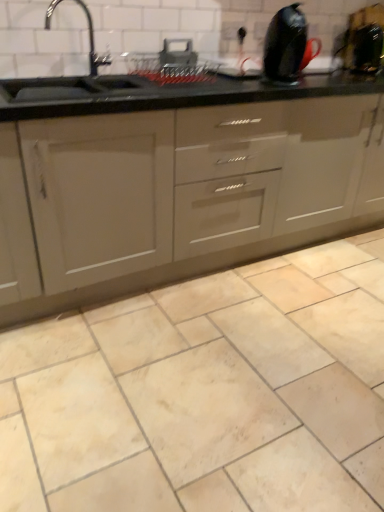
Image resolution: width=384 pixels, height=512 pixels. What do you see at coordinates (170, 64) in the screenshot? I see `metallic silver rack at upper center, the 1th appliance in the left-to-right sequence` at bounding box center [170, 64].

In order to face beige marble tile at center, should I rotate leftwards or rightwards?

You should look right and rotate roughly 15.475 degrees.

Locate an element on the screen. This screenshot has height=512, width=384. glossy black kettle at upper right, arranged as the 3th appliance when viewed from the left is located at coordinates (287, 46).

Image resolution: width=384 pixels, height=512 pixels. Find the location of `black glossy kettle at upper right, which is the 1th appliance from right to left`. black glossy kettle at upper right, which is the 1th appliance from right to left is located at coordinates (364, 49).

The width and height of the screenshot is (384, 512). I want to click on matte gray cabinet at center, so click(187, 192).

Choose the correct answer: Is glossy black kettle at upper right, arranged as the 3th appliance when viewed from the left, inside metallic silver rack at upper center, the 1th appliance in the left-to-right sequence, or outside it?

glossy black kettle at upper right, arranged as the 3th appliance when viewed from the left, is not enclosed by metallic silver rack at upper center, the 1th appliance in the left-to-right sequence.

From the image's perspective, is glossy black kettle at upper right, positioned as the 2th appliance in right-to-left order, above or below metallic silver rack at upper center, acting as the 4th appliance starting from the right?

glossy black kettle at upper right, positioned as the 2th appliance in right-to-left order, is situated higher than metallic silver rack at upper center, acting as the 4th appliance starting from the right, in the image.

Who is taller, glossy black kettle at upper right, positioned as the 2th appliance in right-to-left order, or metallic silver rack at upper center, acting as the 4th appliance starting from the right?

glossy black kettle at upper right, positioned as the 2th appliance in right-to-left order, is taller.

Which is in front, point (286, 77) or point (134, 58)?

The point (286, 77) is closer to the camera.

Would you say black glossy kettle at upper right, the 4th appliance viewed from the left, is part of glossy black kettle at upper right, arranged as the 3th appliance when viewed from the left,'s contents?

No, glossy black kettle at upper right, arranged as the 3th appliance when viewed from the left, does not contain black glossy kettle at upper right, the 4th appliance viewed from the left.

From a real-world perspective, which object stands above the other?

glossy black kettle at upper right, arranged as the 3th appliance when viewed from the left, from a real-world perspective.

Considering the points (308, 61) and (382, 44), which point is behind, point (308, 61) or point (382, 44)?

Positioned behind is point (382, 44).

Can you confirm if glossy black kettle at upper right, arranged as the 3th appliance when viewed from the left, is positioned to the left of black glossy kettle at upper right, the 4th appliance viewed from the left?

Yes, glossy black kettle at upper right, arranged as the 3th appliance when viewed from the left, is to the left of black glossy kettle at upper right, the 4th appliance viewed from the left.

Is metallic silver rack at upper center, the 1th appliance in the left-to-right sequence, next to metallic silver toaster at upper center, the 3th appliance viewed from the right, and touching it?

Yes, metallic silver rack at upper center, the 1th appliance in the left-to-right sequence, is in contact with metallic silver toaster at upper center, the 3th appliance viewed from the right.

Which point is more distant from viewer, (208, 71) or (179, 56)?

Point (208, 71)

Is metallic silver toaster at upper center, the 3th appliance viewed from the right, a part of metallic silver rack at upper center, acting as the 4th appliance starting from the right?

Yes, metallic silver toaster at upper center, the 3th appliance viewed from the right, is a part of metallic silver rack at upper center, acting as the 4th appliance starting from the right.

Looking at their sizes, would you say metallic silver rack at upper center, the 1th appliance in the left-to-right sequence, is wider or thinner than metallic silver toaster at upper center, the 3th appliance viewed from the right?

Clearly, metallic silver rack at upper center, the 1th appliance in the left-to-right sequence, has more width compared to metallic silver toaster at upper center, the 3th appliance viewed from the right.

How different are the orientations of beige marble tile at center and black glossy kettle at upper right, the 4th appliance viewed from the left, in degrees?

5.09 degrees.

You are a GUI agent. You are given a task and a screenshot of the screen. Output one action in this format:
    pyautogui.click(x=<x>, y=<y>)
    Task: Click on the ceramic tile in front of the black glossy kettle at upper right, which is the 1th appliance from right to left
    The height and width of the screenshot is (512, 384).
    Given the screenshot: What is the action you would take?
    pyautogui.click(x=206, y=393)

Considering the relative positions of beige marble tile at center and black glossy kettle at upper right, which is the 1th appliance from right to left, in the image provided, is beige marble tile at center to the left or to the right of black glossy kettle at upper right, which is the 1th appliance from right to left,?

Based on their positions, beige marble tile at center is located to the left of black glossy kettle at upper right, which is the 1th appliance from right to left.

From a real-world perspective, which object stands above the other?

black glossy kettle at upper right, which is the 1th appliance from right to left.

Is black glossy kettle at upper right, which is the 1th appliance from right to left, taller or shorter than glossy black kettle at upper right, arranged as the 3th appliance when viewed from the left?

Considering their sizes, black glossy kettle at upper right, which is the 1th appliance from right to left, has less height than glossy black kettle at upper right, arranged as the 3th appliance when viewed from the left.

From a real-world perspective, is black glossy kettle at upper right, which is the 1th appliance from right to left, located higher than glossy black kettle at upper right, arranged as the 3th appliance when viewed from the left?

Actually, black glossy kettle at upper right, which is the 1th appliance from right to left, is physically below glossy black kettle at upper right, arranged as the 3th appliance when viewed from the left, in the real world.

Is black glossy kettle at upper right, which is the 1th appliance from right to left, oriented towards glossy black kettle at upper right, arranged as the 3th appliance when viewed from the left?

No, black glossy kettle at upper right, which is the 1th appliance from right to left, is not facing towards glossy black kettle at upper right, arranged as the 3th appliance when viewed from the left.

Would you say black glossy kettle at upper right, the 4th appliance viewed from the left, is inside or outside glossy black kettle at upper right, arranged as the 3th appliance when viewed from the left?

black glossy kettle at upper right, the 4th appliance viewed from the left, is located beyond the bounds of glossy black kettle at upper right, arranged as the 3th appliance when viewed from the left.

Is point (166, 66) positioned behind point (379, 30)?

No.

Is metallic silver rack at upper center, the 1th appliance in the left-to-right sequence, next to black glossy kettle at upper right, which is the 1th appliance from right to left, and touching it?

metallic silver rack at upper center, the 1th appliance in the left-to-right sequence, and black glossy kettle at upper right, which is the 1th appliance from right to left, are not in contact.

From a real-world perspective, is metallic silver rack at upper center, the 1th appliance in the left-to-right sequence, physically below black glossy kettle at upper right, which is the 1th appliance from right to left?

Yes.

Is the position of metallic silver rack at upper center, acting as the 4th appliance starting from the right, less distant than that of black glossy kettle at upper right, which is the 1th appliance from right to left?

Yes.

From a real-world perspective, is matte gray cabinet at center over glossy black kettle at upper right, arranged as the 3th appliance when viewed from the left?

No, from a real-world perspective, matte gray cabinet at center is not over glossy black kettle at upper right, arranged as the 3th appliance when viewed from the left

Is matte gray cabinet at center completely or partially outside of glossy black kettle at upper right, arranged as the 3th appliance when viewed from the left?

That's correct, matte gray cabinet at center is outside of glossy black kettle at upper right, arranged as the 3th appliance when viewed from the left.

Between point (347, 104) and point (297, 67), which one is positioned behind?

The point (347, 104) is behind.

From the image's perspective, between matte gray cabinet at center and glossy black kettle at upper right, arranged as the 3th appliance when viewed from the left, which one is located above?

glossy black kettle at upper right, arranged as the 3th appliance when viewed from the left, from the image's perspective.

Where is `the 3rd appliance below the glossy black kettle at upper right, positioned as the 2th appliance in right-to-left order (from a real-world perspective)`? The image size is (384, 512). the 3rd appliance below the glossy black kettle at upper right, positioned as the 2th appliance in right-to-left order (from a real-world perspective) is located at coordinates (170, 64).

Starting from the black glossy kettle at upper right, which is the 1th appliance from right to left, which appliance is the 3rd one in front? Please provide its 2D coordinates.

[(287, 46)]

Looking at the image, which one is located closer to matte gray cabinet at center, metallic silver rack at upper center, acting as the 4th appliance starting from the right, or glossy black kettle at upper right, positioned as the 2th appliance in right-to-left order?

metallic silver rack at upper center, acting as the 4th appliance starting from the right, is positioned closer to the anchor matte gray cabinet at center.

In the scene shown: Estimate the real-world distances between objects in this image. Which object is further from beige marble tile at center, metallic silver toaster at upper center, the 3th appliance viewed from the right, or glossy black kettle at upper right, positioned as the 2th appliance in right-to-left order?

glossy black kettle at upper right, positioned as the 2th appliance in right-to-left order, is further to beige marble tile at center.

Considering their positions, is glossy black kettle at upper right, arranged as the 3th appliance when viewed from the left, positioned closer to beige marble tile at center than metallic silver rack at upper center, the 1th appliance in the left-to-right sequence?

metallic silver rack at upper center, the 1th appliance in the left-to-right sequence.

From the image, which object appears to be farther from metallic silver toaster at upper center, the 3th appliance viewed from the right, beige marble tile at center or metallic silver rack at upper center, acting as the 4th appliance starting from the right?

beige marble tile at center.

Estimate the real-world distances between objects in this image. Which object is closer to metallic silver toaster at upper center, acting as the 2th appliance starting from the left, metallic silver rack at upper center, acting as the 4th appliance starting from the right, or black glossy kettle at upper right, which is the 1th appliance from right to left?

Among the two, metallic silver rack at upper center, acting as the 4th appliance starting from the right, is located nearer to metallic silver toaster at upper center, acting as the 2th appliance starting from the left.

Looking at the image, which one is located further to metallic silver toaster at upper center, acting as the 2th appliance starting from the left, matte gray cabinet at center or metallic silver rack at upper center, the 1th appliance in the left-to-right sequence?

The object further to metallic silver toaster at upper center, acting as the 2th appliance starting from the left, is matte gray cabinet at center.

Looking at the image, which one is located closer to black glossy kettle at upper right, which is the 1th appliance from right to left, beige marble tile at center or metallic silver rack at upper center, acting as the 4th appliance starting from the right?

metallic silver rack at upper center, acting as the 4th appliance starting from the right, is closer to black glossy kettle at upper right, which is the 1th appliance from right to left.

Estimate the real-world distances between objects in this image. Which object is further from glossy black kettle at upper right, arranged as the 3th appliance when viewed from the left, matte gray cabinet at center or metallic silver rack at upper center, acting as the 4th appliance starting from the right?

Based on the image, matte gray cabinet at center appears to be further to glossy black kettle at upper right, arranged as the 3th appliance when viewed from the left.

The image size is (384, 512). I want to click on cabinetry between metallic silver toaster at upper center, acting as the 2th appliance starting from the left, and beige marble tile at center from top to bottom, so click(x=187, y=192).

At what (x,y) coordinates should I click in order to perform the action: click on cabinetry between metallic silver rack at upper center, the 1th appliance in the left-to-right sequence, and beige marble tile at center vertically. Please return your answer as a coordinate pair (x, y). The width and height of the screenshot is (384, 512). Looking at the image, I should click on (187, 192).

The height and width of the screenshot is (512, 384). Identify the location of cabinetry between metallic silver rack at upper center, acting as the 4th appliance starting from the right, and black glossy kettle at upper right, which is the 1th appliance from right to left, from left to right. (187, 192).

Where is `appliance that lies between metallic silver toaster at upper center, the 3th appliance viewed from the right, and beige marble tile at center from top to bottom`? appliance that lies between metallic silver toaster at upper center, the 3th appliance viewed from the right, and beige marble tile at center from top to bottom is located at coordinates (170, 64).